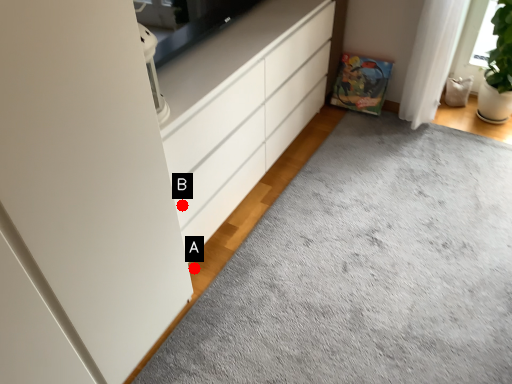
Question: Two points are circled on the image, labeled by A and B beside each circle. Which point appears closest to the camera in this image?

Choices:
 (A) A is closer
 (B) B is closer

Answer: (B)